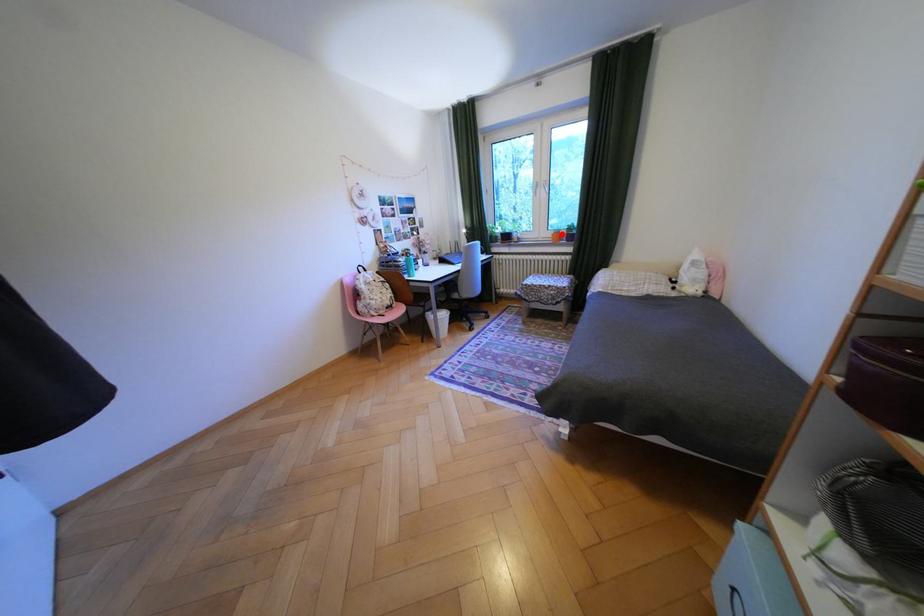
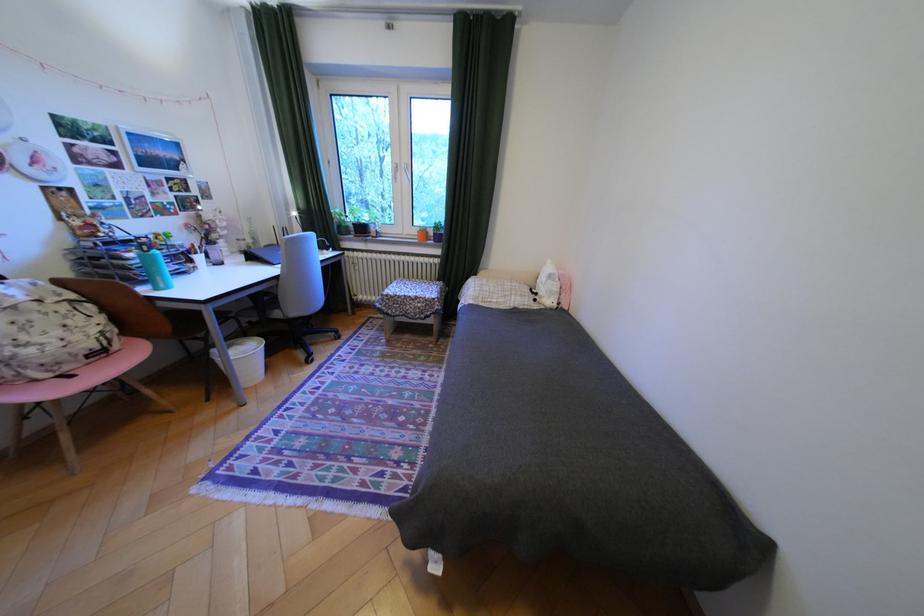
Question: I am providing you with two images of the same scene from different viewpoints. A red point is marked on the first image. At the location where the point appears in image 1, is it still visible in image 2?

Choices:
 (A) Yes
 (B) No

Answer: (A)